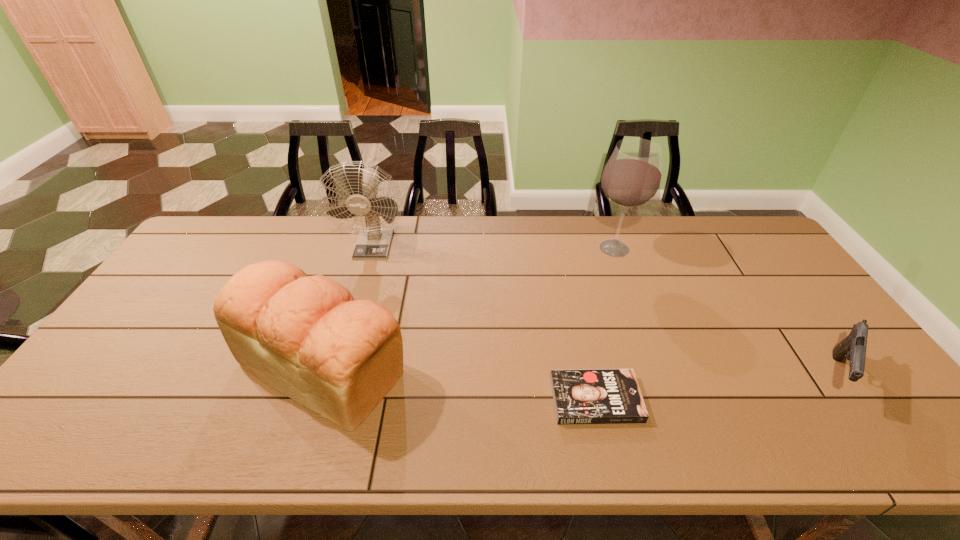
Where is `free spot between the gun and the shortest object`? Image resolution: width=960 pixels, height=540 pixels. free spot between the gun and the shortest object is located at coordinates (715, 387).

You are a GUI agent. You are given a task and a screenshot of the screen. Output one action in this format:
    pyautogui.click(x=<x>, y=<y>)
    Task: Click on the vacant space that is in between the alcohol and the shortest object
    The height and width of the screenshot is (540, 960).
    Given the screenshot: What is the action you would take?
    pyautogui.click(x=605, y=323)

Where is `vacant region between the book and the gun`? vacant region between the book and the gun is located at coordinates (715, 387).

The image size is (960, 540). What are the coordinates of `vacant area that lies between the second shortest object and the shortest object` in the screenshot? It's located at (715, 387).

In order to click on free point between the fan and the shortest object in this screenshot , I will do `click(485, 321)`.

I want to click on empty location between the book and the bread, so click(x=459, y=383).

Locate an element on the screen. vacant space in between the fan and the book is located at coordinates (485, 321).

Find the location of `free space between the gun and the book`. free space between the gun and the book is located at coordinates (715, 387).

I want to click on vacant area that lies between the fan and the second shortest object, so click(x=604, y=309).

Point out which object is positioned as the nearest to the bread. Please provide its 2D coordinates. Your answer should be formatted as a tuple, i.e. [(x, y)], where the tuple contains the x and y coordinates of a point satisfying the conditions above.

[(373, 242)]